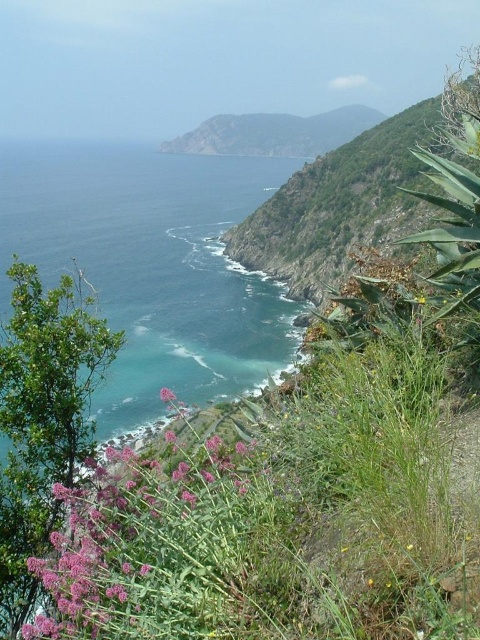
Between blue water at lower left and purple matte flower at lower left, which one is positioned higher?

blue water at lower left is higher up.

Can you confirm if blue water at lower left is taller than purple matte flower at lower left?

Correct, blue water at lower left is much taller as purple matte flower at lower left.

Is point (204, 227) positioned after point (170, 396)?

Yes, it is.

What are the coordinates of `blue water at lower left` in the screenshot? It's located at (152, 266).

How far apart are green rough rock at center and purple matte flower at lower left?

They are 64.26 meters apart.

Who is taller, green rough rock at center or purple matte flower at lower left?

green rough rock at center

Who is more distant from viewer, (311, 221) or (166, 394)?

The point (311, 221) is behind.

Locate an element on the screen. green rough rock at center is located at coordinates (348, 196).

What do you see at coordinates (348, 196) in the screenshot?
I see `green rough rock at center` at bounding box center [348, 196].

Is point (335, 173) farther from camera compared to point (255, 122)?

No, it is in front of (255, 122).

The height and width of the screenshot is (640, 480). What do you see at coordinates (348, 196) in the screenshot? I see `green rough rock at center` at bounding box center [348, 196].

You are a GUI agent. You are given a task and a screenshot of the screen. Output one action in this format:
    pyautogui.click(x=<x>, y=<y>)
    Task: Click on the green rough rock at center
    
    Given the screenshot: What is the action you would take?
    pyautogui.click(x=348, y=196)